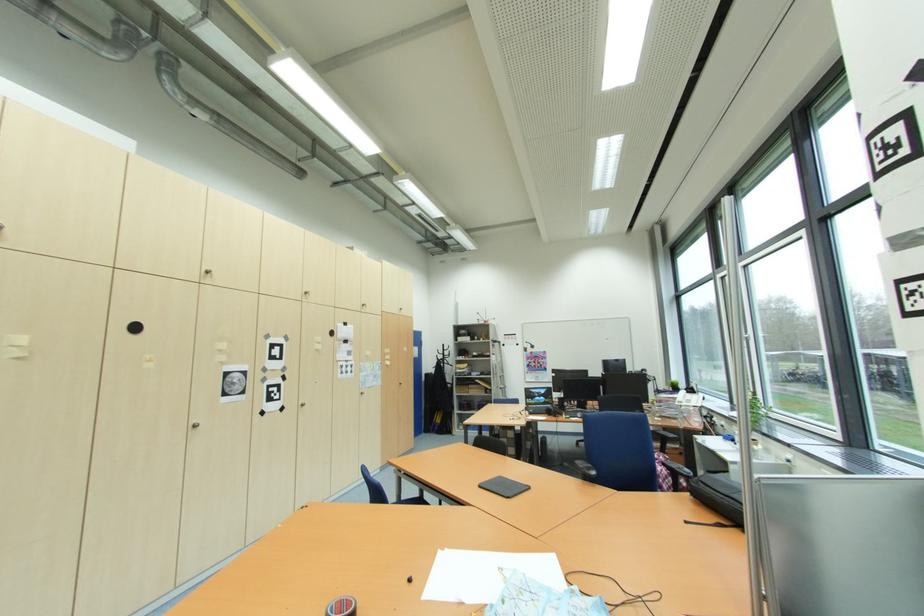
Find where to resting arm on the blue chair armrest. Please return your answer as a coordinate pair (x, y).

(675, 469)